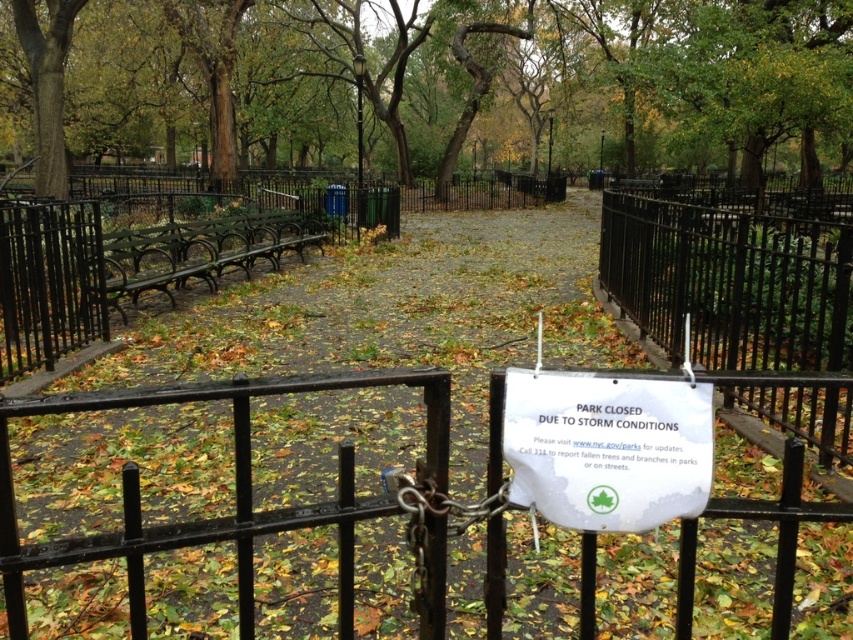
You are a park ranger standing at the entrance of the park. You need to locate the brown wood tree at center. According to the coordinates provided, where should you look to find it?

The brown wood tree at center is located at coordinates point (427, 81).

You are a delivery driver who needs to enter the park but sees the closed sign. Can you go through the black wrought iron gate at center to the left of the white paper sign at center?

The black wrought iron gate at center is positioned on the left side of white paper sign at center. However, the park is closed due to storm conditions, so you should not enter through the gate.